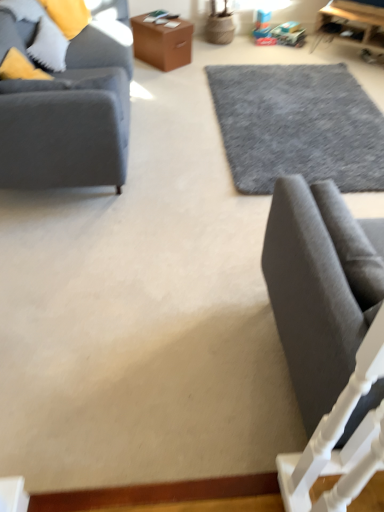
Question: Based on their sizes in the image, would you say matte gray fabric couch at left, the 1th studio couch in the top-to-bottom sequence, is bigger or smaller than brown leather box at upper center, which is the second table from right to left?

Choices:
 (A) small
 (B) big

Answer: (B)

Question: Is matte gray fabric couch at left, the 2th studio couch from the front, in front of or behind brown leather box at upper center, the 1th table in the left-to-right sequence, in the image?

Choices:
 (A) behind
 (B) front

Answer: (B)

Question: Estimate the real-world distances between objects in this image. Which object is closer to the gray wool rug at center?

Choices:
 (A) wooden table at upper right, marked as the second table in a left-to-right arrangement
 (B) brown leather box at upper center, which is the second table from right to left
 (C) dark gray fabric studio couch at lower right, which is counted as the second studio couch, starting from the top
 (D) matte gray fabric couch at left, the 1th studio couch in the top-to-bottom sequence

Answer: (B)

Question: Which is nearer to the brown leather box at upper center, the 1th table in the left-to-right sequence?

Choices:
 (A) gray wool rug at center
 (B) dark gray fabric studio couch at lower right, which is counted as the second studio couch, starting from the top
 (C) matte gray fabric couch at left, which is counted as the second studio couch, starting from the right
 (D) wooden table at upper right, acting as the 1th table starting from the right

Answer: (A)